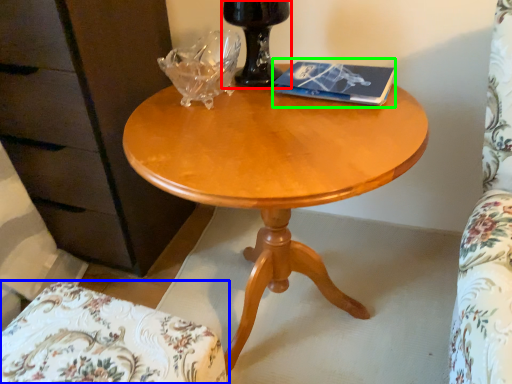
Question: Which is farther away from glass vase (highlighted by a red box)? chair (highlighted by a blue box) or paperback book (highlighted by a green box)?

Choices:
 (A) chair
 (B) paperback book

Answer: (A)